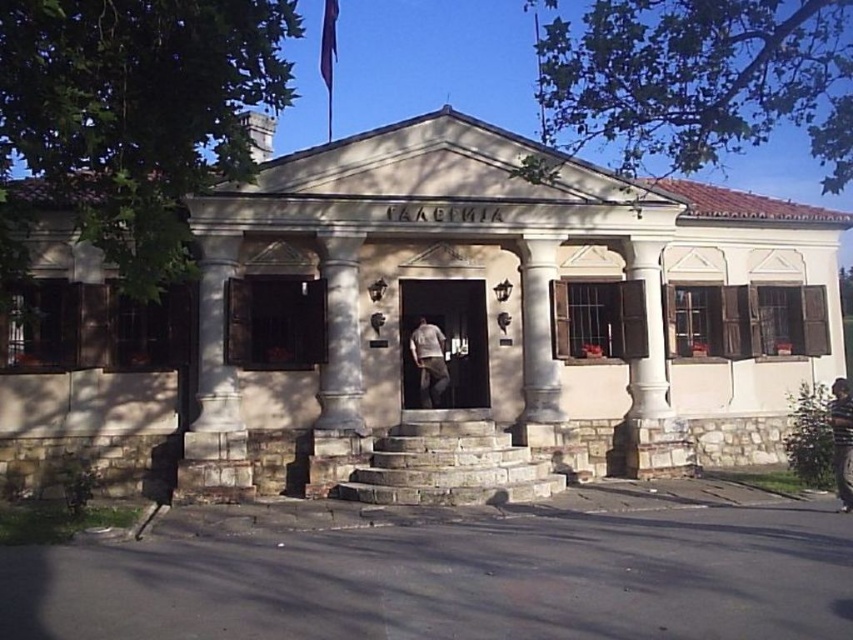
Question: Does white marble column at center have a greater width compared to brown leather jacket at lower right?

Choices:
 (A) yes
 (B) no

Answer: (A)

Question: Which point is closer to the camera taking this photo?

Choices:
 (A) (848, 436)
 (B) (440, 348)
 (C) (543, 323)

Answer: (A)

Question: Is white marble column at center smaller than white cotton shirt at center?

Choices:
 (A) yes
 (B) no

Answer: (B)

Question: Which object appears closest to the camera in this image?

Choices:
 (A) brown leather jacket at lower right
 (B) white cotton shirt at center

Answer: (A)

Question: Is white marble column at center wider than white cotton shirt at center?

Choices:
 (A) yes
 (B) no

Answer: (A)

Question: Among these points, which one is nearest to the camera?

Choices:
 (A) (415, 362)
 (B) (844, 380)

Answer: (B)